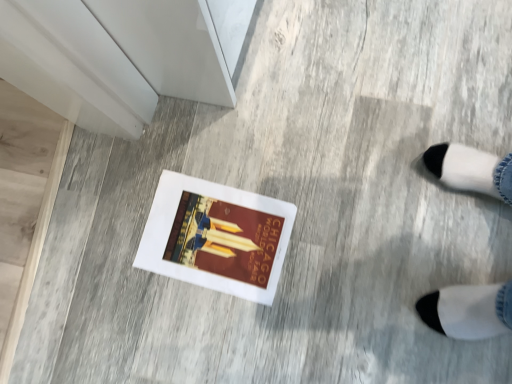
Where is `matte paper postcard at center`? The image size is (512, 384). matte paper postcard at center is located at coordinates (216, 237).

Image resolution: width=512 pixels, height=384 pixels. Describe the element at coordinates (216, 237) in the screenshot. I see `matte paper postcard at center` at that location.

What is the approximate height of matte paper postcard at center?

The height of matte paper postcard at center is 0.57 inches.

Identify the location of matte paper postcard at center. (216, 237).